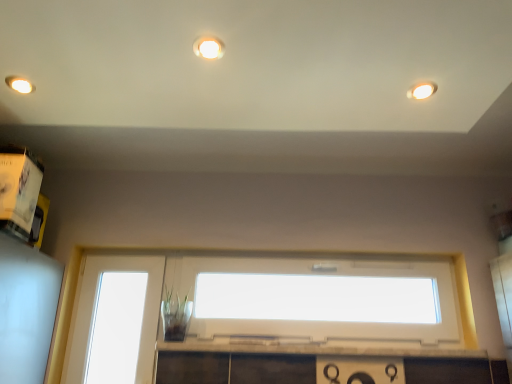
Question: Is transparent glass window at lower left, the 1th window in the left-to-right sequence, further to the viewer compared to matte white light fixture at upper center, the third lighting when ordered from back to front?

Choices:
 (A) no
 (B) yes

Answer: (B)

Question: Is transparent glass window at lower left, which appears as the 2th window when viewed from the right, oriented towards matte white light fixture at upper center, the 3th lighting in the bottom-to-top sequence?

Choices:
 (A) yes
 (B) no

Answer: (A)

Question: Does transparent glass window at lower left, which appears as the 2th window when viewed from the right, have a lesser height compared to matte white light fixture at upper center, the 2th lighting from the left?

Choices:
 (A) no
 (B) yes

Answer: (A)

Question: From a real-world perspective, does transparent glass window at lower left, the 1th window in the left-to-right sequence, stand above matte white light fixture at upper center, marked as the first lighting in a front-to-back arrangement?

Choices:
 (A) yes
 (B) no

Answer: (B)

Question: Is transparent glass window at lower left, the 1th window in the left-to-right sequence, to the right of matte white light fixture at upper center, marked as the first lighting in a front-to-back arrangement, from the viewer's perspective?

Choices:
 (A) no
 (B) yes

Answer: (A)

Question: From the image's perspective, is matte white light fixture at upper left, which appears as the 2th lighting when ordered from the bottom, above or below transparent glass window at lower left, the 1th window in the left-to-right sequence?

Choices:
 (A) above
 (B) below

Answer: (A)

Question: From a real-world perspective, is matte white light fixture at upper left, which appears as the 2th lighting when ordered from the bottom, physically located above or below transparent glass window at lower left, which appears as the 2th window when viewed from the right?

Choices:
 (A) below
 (B) above

Answer: (B)

Question: Considering the positions of matte white light fixture at upper left, acting as the 3th lighting starting from the front, and transparent glass window at lower left, the 1th window in the left-to-right sequence, in the image, is matte white light fixture at upper left, acting as the 3th lighting starting from the front, wider or thinner than transparent glass window at lower left, the 1th window in the left-to-right sequence,?

Choices:
 (A) thin
 (B) wide

Answer: (B)

Question: In terms of size, does matte white light fixture at upper left, which is the 3th lighting from right to left, appear bigger or smaller than transparent glass window at lower left, which appears as the 2th window when viewed from the right?

Choices:
 (A) small
 (B) big

Answer: (A)

Question: From a real-world perspective, is matte white light fixture at upper right, the 3th lighting viewed from the left, physically located above or below transparent glass window at lower left, which appears as the 2th window when viewed from the right?

Choices:
 (A) below
 (B) above

Answer: (B)

Question: From the image's perspective, relative to transparent glass window at lower left, the 1th window in the left-to-right sequence, is matte white light fixture at upper right, positioned as the 1th lighting in right-to-left order, above or below?

Choices:
 (A) below
 (B) above

Answer: (B)

Question: Relative to transparent glass window at lower left, the 1th window in the left-to-right sequence, is matte white light fixture at upper right, positioned as the first lighting in bottom-to-top order, in front or behind?

Choices:
 (A) front
 (B) behind

Answer: (A)

Question: Would you say matte white light fixture at upper right, marked as the third lighting in a top-to-bottom arrangement, is inside or outside transparent glass window at lower left, which appears as the 2th window when viewed from the right?

Choices:
 (A) inside
 (B) outside

Answer: (B)

Question: Does point (201, 46) appear closer or farther from the camera than point (105, 370)?

Choices:
 (A) closer
 (B) farther

Answer: (A)

Question: Based on their sizes in the image, would you say matte white light fixture at upper center, marked as the first lighting in a front-to-back arrangement, is bigger or smaller than transparent glass window at lower left, which appears as the 2th window when viewed from the right?

Choices:
 (A) big
 (B) small

Answer: (B)